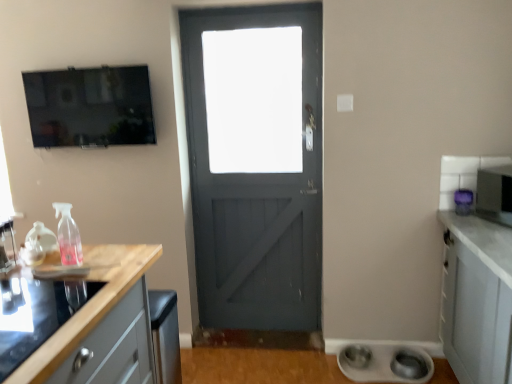
The image size is (512, 384). In order to click on vacant point above matte black tv at upper left (from a real-world perspective) in this screenshot , I will do `click(77, 68)`.